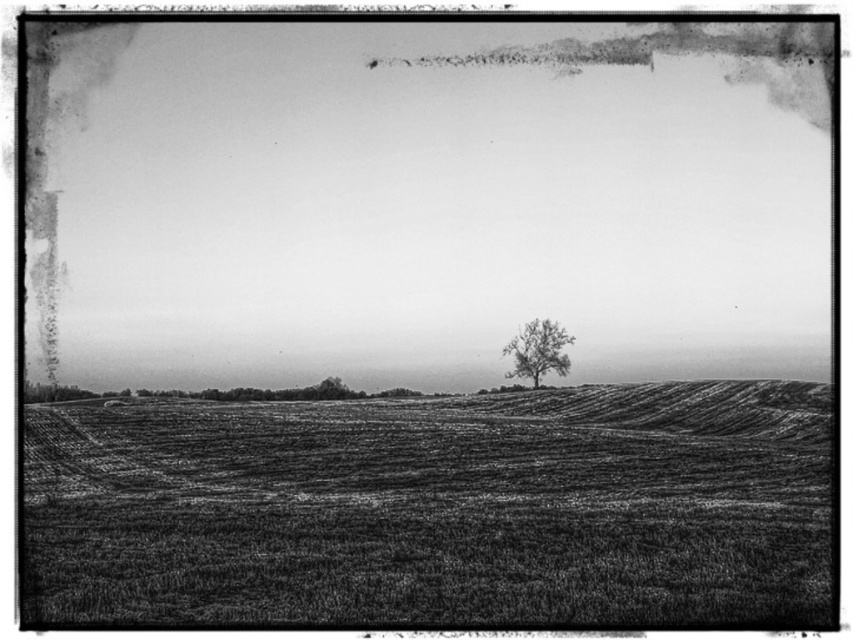
Locate an element on the screen. Image resolution: width=853 pixels, height=640 pixels. smooth soil at center is located at coordinates (279, 371).

Between smooth soil at center and bare branch tree at center, which one appears on the right side from the viewer's perspective?

bare branch tree at center is more to the right.

Is point (677, 369) positioned behind point (543, 336)?

Yes.

The height and width of the screenshot is (640, 853). In order to click on smooth soil at center in this screenshot , I will do `click(279, 371)`.

Can you confirm if grainy soil field at center is wider than smooth soil at center?

No, grainy soil field at center is not wider than smooth soil at center.

Does grainy soil field at center have a greater height compared to smooth soil at center?

No.

The image size is (853, 640). What do you see at coordinates (434, 508) in the screenshot?
I see `grainy soil field at center` at bounding box center [434, 508].

Identify the location of grainy soil field at center. (434, 508).

Is the position of grainy soil field at center more distant than that of bare branch tree at center?

No, grainy soil field at center is in front of bare branch tree at center.

This screenshot has width=853, height=640. I want to click on grainy soil field at center, so click(x=434, y=508).

You are a GUI agent. You are given a task and a screenshot of the screen. Output one action in this format:
    pyautogui.click(x=<x>, y=<y>)
    Task: Click on the grainy soil field at center
    The width and height of the screenshot is (853, 640).
    Given the screenshot: What is the action you would take?
    pyautogui.click(x=434, y=508)